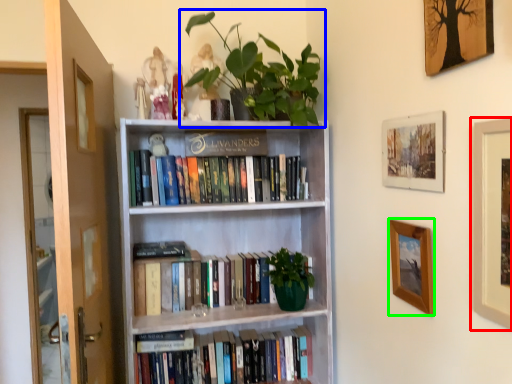
Question: Estimate the real-world distances between objects in this image. Which object is closer to picture frame (highlighted by a red box), houseplant (highlighted by a blue box) or picture frame (highlighted by a green box)?

Choices:
 (A) houseplant
 (B) picture frame

Answer: (B)